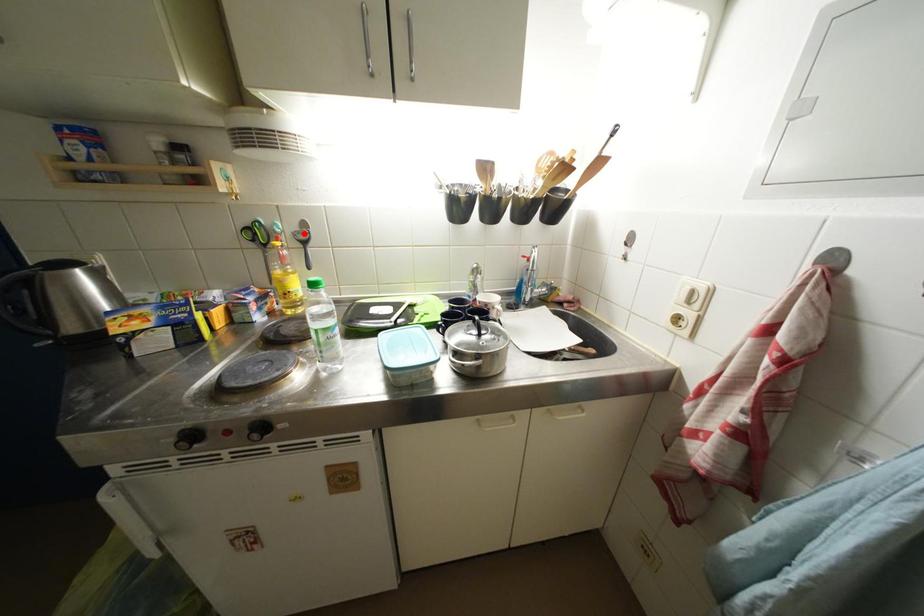
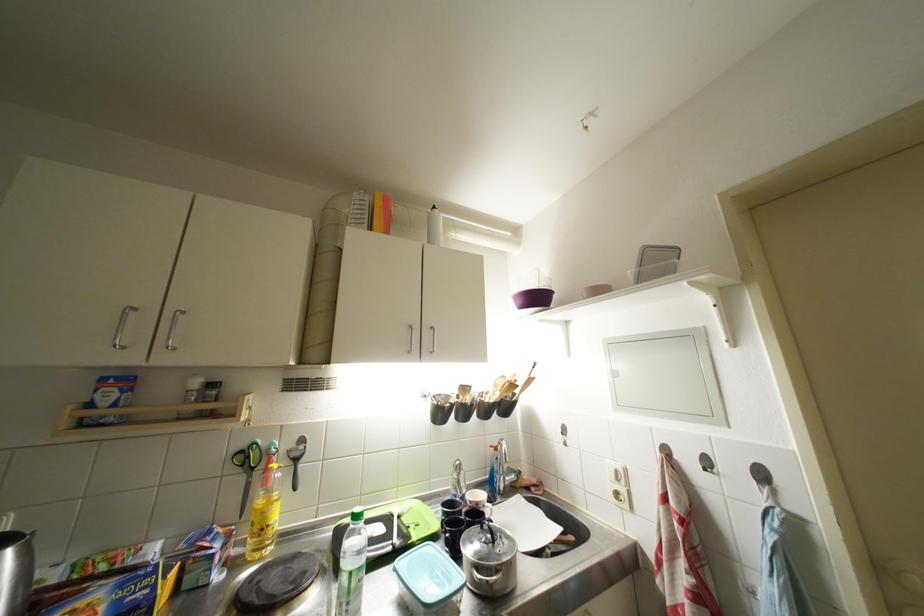
Question: I am providing you with two images of the same scene from different viewpoints. Image1 has a red point marked. In image2, the corresponding 3D location appears at what relative position? Reply with the corresponding letter.

Choices:
 (A) Closer
 (B) Farther

Answer: (B)